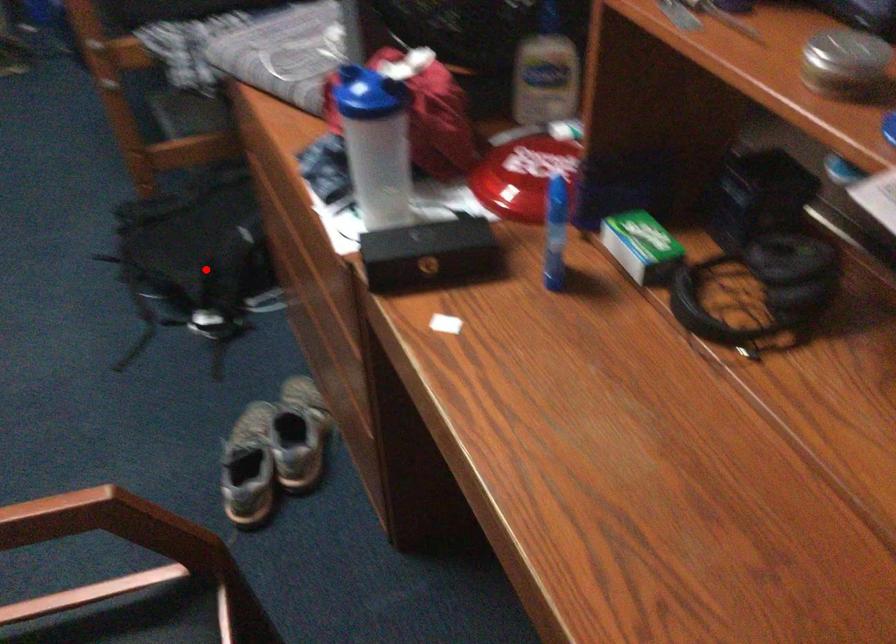
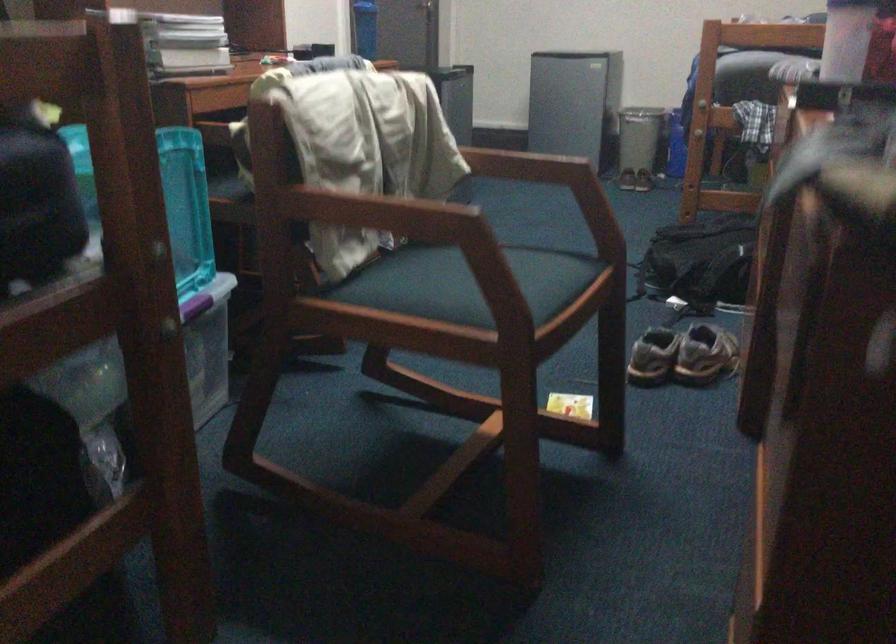
Question: A red point is marked in image1. In image2, is the corresponding 3D point closer to the camera or farther? Reply with the corresponding letter.

Choices:
 (A) The corresponding 3D point is closer.
 (B) The corresponding 3D point is farther.

Answer: (B)